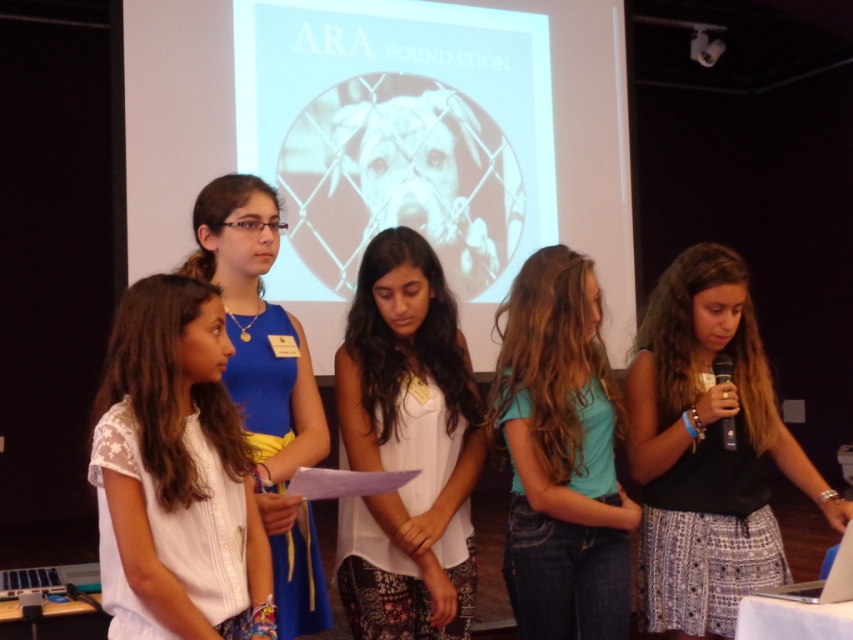
Question: Which point appears closest to the camera in this image?

Choices:
 (A) (699, 312)
 (B) (277, 349)
 (C) (442, 408)
 (D) (602, 413)

Answer: (B)

Question: Observing the image, what is the correct spatial positioning of teal denim jeans at center in reference to white fabric shirt at left?

Choices:
 (A) left
 (B) right

Answer: (B)

Question: Does white cotton shirt at center appear over teal denim jeans at center?

Choices:
 (A) no
 (B) yes

Answer: (B)

Question: Is the position of white lace blouse at center less distant than that of white cotton shirt at center?

Choices:
 (A) no
 (B) yes

Answer: (B)

Question: Which point is farther to the camera?

Choices:
 (A) teal denim jeans at center
 (B) white lace blouse at center
 (C) black cotton shirt at center

Answer: (C)

Question: Which point is farther to the camera?

Choices:
 (A) white fabric shirt at left
 (B) white lace blouse at center
 (C) teal denim jeans at center
 (D) black cotton shirt at center

Answer: (D)